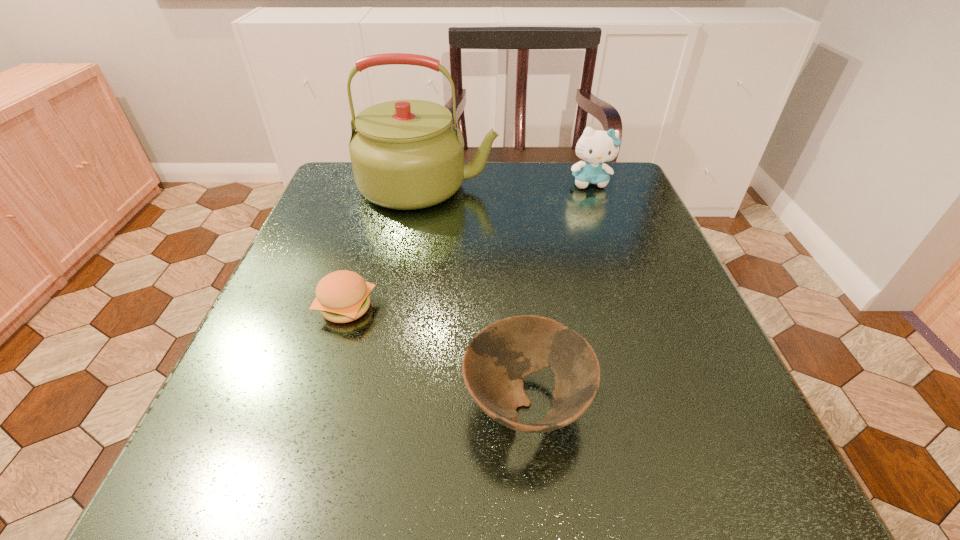
You are a GUI agent. You are given a task and a screenshot of the screen. Output one action in this format:
    pyautogui.click(x=<x>, y=<y>)
    Task: Click on the vacant area that lies between the rightmost object and the third tallest object
    The width and height of the screenshot is (960, 540).
    Given the screenshot: What is the action you would take?
    pyautogui.click(x=558, y=293)

Image resolution: width=960 pixels, height=540 pixels. In order to click on free area in between the nearest object and the kettle in this screenshot , I will do `click(477, 295)`.

Locate an element on the screen. The height and width of the screenshot is (540, 960). vacant region between the kettle and the second nearest object is located at coordinates (387, 247).

The width and height of the screenshot is (960, 540). In order to click on unoccupied area between the nearest object and the tallest object in this screenshot , I will do `click(477, 295)`.

The image size is (960, 540). Find the location of `empty location between the kettle and the nearest object`. empty location between the kettle and the nearest object is located at coordinates (477, 295).

Select which object appears as the third closest to the tallest object. Please provide its 2D coordinates. Your answer should be formatted as a tuple, i.e. [(x, y)], where the tuple contains the x and y coordinates of a point satisfying the conditions above.

[(496, 360)]

This screenshot has height=540, width=960. Identify the location of object that stands as the closest to the kitten. click(x=406, y=154).

Where is `free spot that satisfies the following two spatial constraints: 1. on the back side of the third tallest object; 2. at the spout of the kettle`? The width and height of the screenshot is (960, 540). free spot that satisfies the following two spatial constraints: 1. on the back side of the third tallest object; 2. at the spout of the kettle is located at coordinates (507, 186).

Identify the location of vacant region that satisfies the following two spatial constraints: 1. at the spout of the kettle; 2. on the left side of the second shortest object. (392, 403).

Image resolution: width=960 pixels, height=540 pixels. What are the coordinates of `free space that satisfies the following two spatial constraints: 1. at the spout of the kettle; 2. on the right side of the second shortest object` in the screenshot? It's located at click(x=392, y=403).